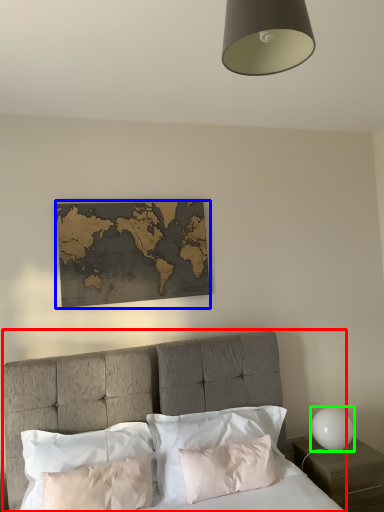
Question: Considering the real-world distances, which object is farthest from bed (highlighted by a red box)? picture frame (highlighted by a blue box) or table lamp (highlighted by a green box)?

Choices:
 (A) picture frame
 (B) table lamp

Answer: (B)